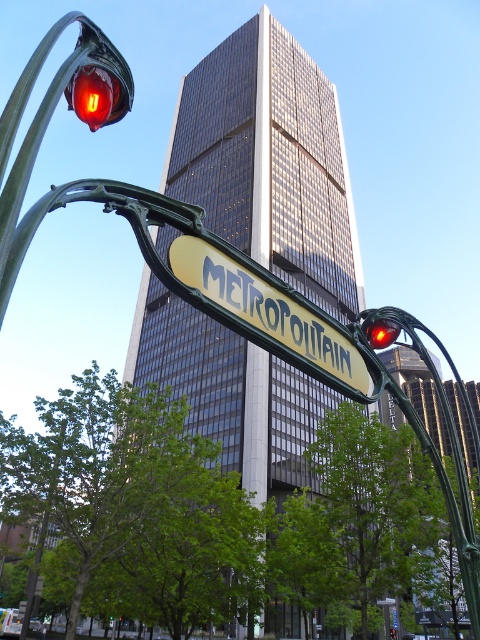
You are a pedestrian standing at the intersection and see both the matte red traffic light at upper left and the glossy plastic traffic light at center. Which traffic light is positioned more to the left side of the intersection?

The matte red traffic light at upper left is positioned more to the left side of the intersection.